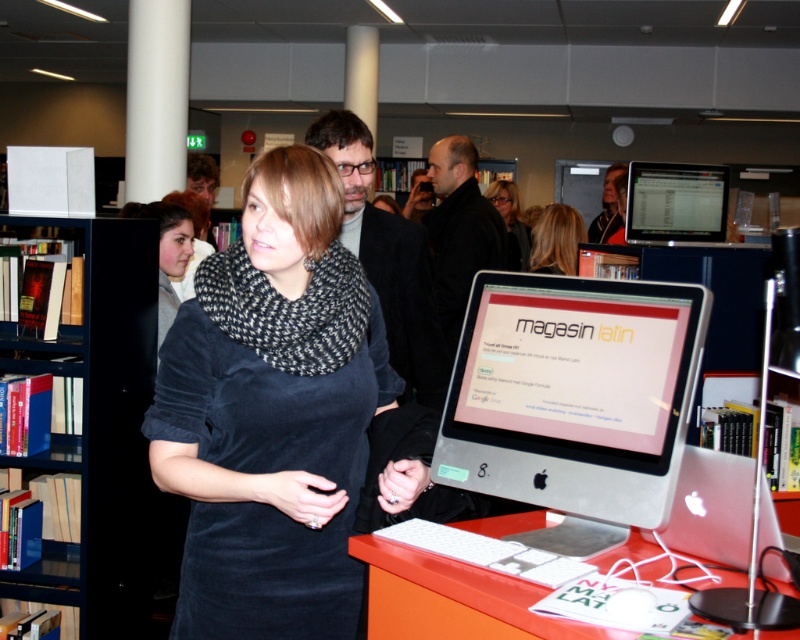
You are standing in the library and want to place a book on the desk between the white smooth pillar at upper left and the dark gray sweater at center. Can you fit the book there?

The white smooth pillar at upper left is to the left of the dark gray sweater at center, so there is space between them where you can place the book.

You are organizing a fashion show and need to display two scarves on a mannequin. The matte black scarf at center and the black knit scarf at center are available. Which scarf would you choose if you want the thinner one for the mannequin?

The matte black scarf at center is thinner than the black knit scarf at center, so you should choose the matte black scarf at center for the thinner option.

You are an interior designer planning to place a new decorative item between the velvet dress at center and the white smooth pillar at upper left. Considering their sizes, which object should the item be placed closer to?

The velvet dress at center is thinner than the white smooth pillar at upper left, so the new decorative item should be placed closer to the velvet dress at center to maintain balance between the two objects.